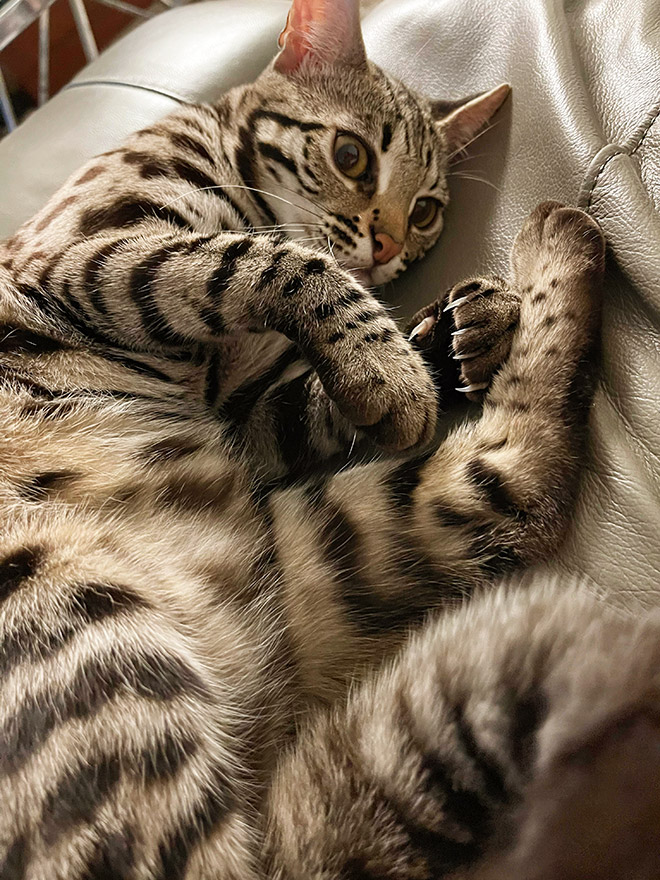
I want to click on stitching of leather furniture, so click(x=603, y=158), click(x=131, y=83).